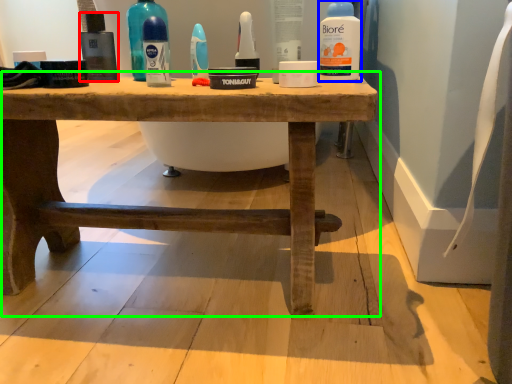
Question: Which is farther away from mouthwash (highlighted by a red box)? cleaning product (highlighted by a blue box) or table (highlighted by a green box)?

Choices:
 (A) cleaning product
 (B) table

Answer: (A)